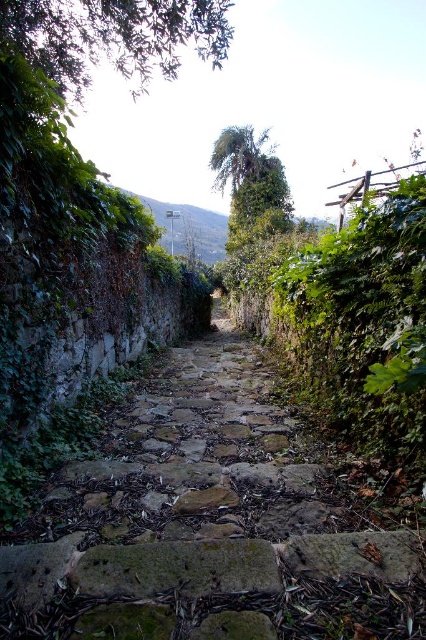
Measure the distance between green mossy stone at center and green leafy hillside at center.

green mossy stone at center is 18.77 meters away from green leafy hillside at center.

Is green mossy stone at center shorter than green leafy hillside at center?

Correct, green mossy stone at center is not as tall as green leafy hillside at center.

Between point (109, 588) and point (164, 216), which one is positioned behind?

The point (164, 216) is behind.

This screenshot has height=640, width=426. Find the location of `green mossy stone at center`. green mossy stone at center is located at coordinates (178, 568).

Between point (169, 561) and point (319, 554), which one is positioned behind?

Point (319, 554)

Does point (97, 580) lie behind point (397, 556)?

No, (97, 580) is closer to viewer.

Is point (215, 588) positioned behind point (356, 556)?

No, it is in front of (356, 556).

Find the location of a particular element. green mossy stone at center is located at coordinates (178, 568).

Does brown rough stone at center have a greater width compared to green leafy hillside at center?

No.

What do you see at coordinates (356, 554) in the screenshot? I see `brown rough stone at center` at bounding box center [356, 554].

Who is more distant from viewer, (379, 566) or (204, 227)?

Point (204, 227)

You are a GUI agent. You are given a task and a screenshot of the screen. Output one action in this format:
    pyautogui.click(x=<x>, y=<y>)
    Task: Click on the brown rough stone at center
    The image size is (426, 640).
    Given the screenshot: What is the action you would take?
    pyautogui.click(x=356, y=554)